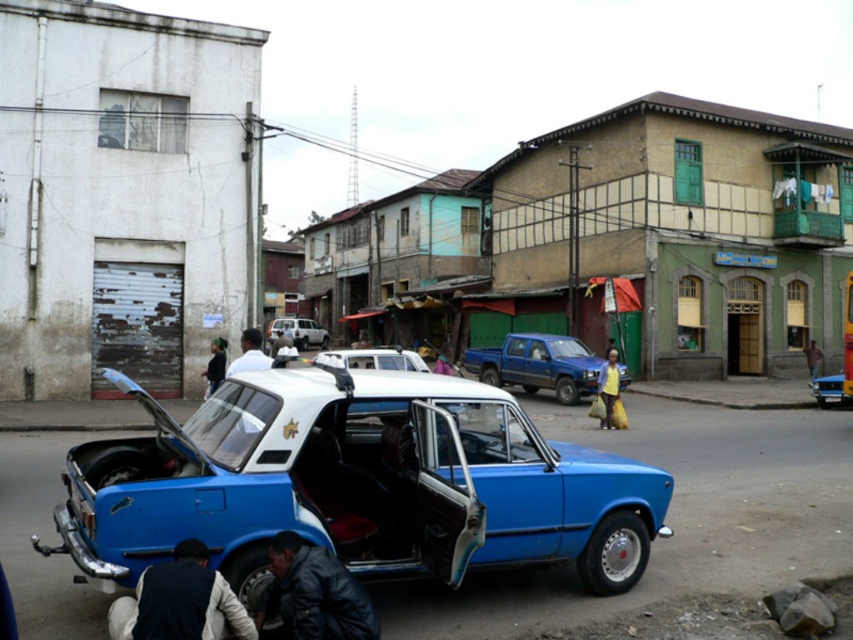
Is white matte car at center behind matte silver suv at center?

No, it is in front of matte silver suv at center.

Measure the distance between white matte car at center and matte silver suv at center.

The distance of white matte car at center from matte silver suv at center is 5.30 meters.

Does point (373, 365) come in front of point (296, 336)?

That is True.

You are a GUI agent. You are given a task and a screenshot of the screen. Output one action in this format:
    pyautogui.click(x=<x>, y=<y>)
    Task: Click on the white matte car at center
    The image size is (853, 640).
    Given the screenshot: What is the action you would take?
    pyautogui.click(x=373, y=358)

Which is below, blue matte car at center or matte silver suv at center?

blue matte car at center

At what (x,y) coordinates should I click in order to perform the action: click on blue matte car at center. Please return your answer as a coordinate pair (x, y). Looking at the image, I should click on (355, 483).

Image resolution: width=853 pixels, height=640 pixels. I want to click on blue matte car at center, so click(x=355, y=483).

Where is `blue matte car at center`? Image resolution: width=853 pixels, height=640 pixels. blue matte car at center is located at coordinates (355, 483).

Between point (302, 611) and point (223, 364), which one is positioned in front?

Positioned in front is point (302, 611).

Is leather jacket at lower center shorter than dark blue shirt at center?

Correct, leather jacket at lower center is not as tall as dark blue shirt at center.

Does point (288, 584) come in front of point (218, 348)?

Yes, it is.

The width and height of the screenshot is (853, 640). What are the coordinates of `leather jacket at lower center` in the screenshot? It's located at (314, 593).